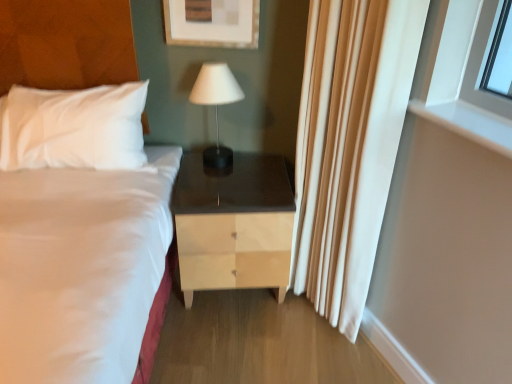
The width and height of the screenshot is (512, 384). In order to click on free space in front of white matte table lamp at center in this screenshot , I will do `click(214, 179)`.